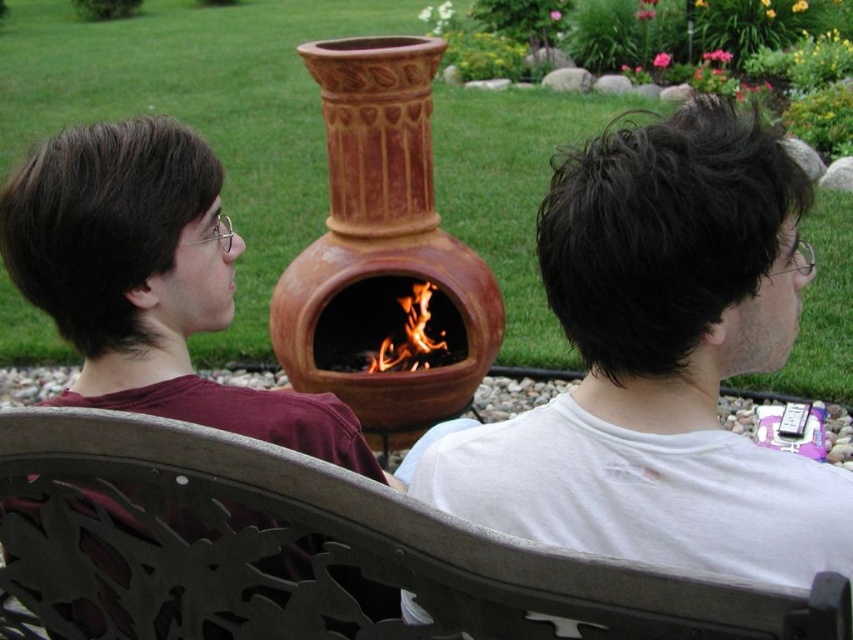
Is metallic gray chair at lower center to the left of white cotton shirt at center from the viewer's perspective?

Incorrect, metallic gray chair at lower center is not on the left side of white cotton shirt at center.

Who is more forward, (239,538) or (160,124)?

Positioned in front is point (239,538).

The height and width of the screenshot is (640, 853). Identify the location of metallic gray chair at lower center. (306, 552).

Looking at this image, is metallic gray chair at lower center bigger than flamewoodenfire at center?

Yes.

Who is more distant from viewer, (828, 609) or (410, 364)?

The point (410, 364) is behind.

Between point (123, 458) and point (408, 355), which one is positioned in front?

Point (123, 458)

The image size is (853, 640). I want to click on metallic gray chair at lower center, so click(306, 552).

Which is more to the left, white cotton shirt at center or flamewoodenfire at center?

Positioned to the left is white cotton shirt at center.

Does white cotton shirt at center have a lesser height compared to flamewoodenfire at center?

No.

The image size is (853, 640). Describe the element at coordinates (149, 282) in the screenshot. I see `white cotton shirt at center` at that location.

Where is `white cotton shirt at center`? white cotton shirt at center is located at coordinates (149, 282).